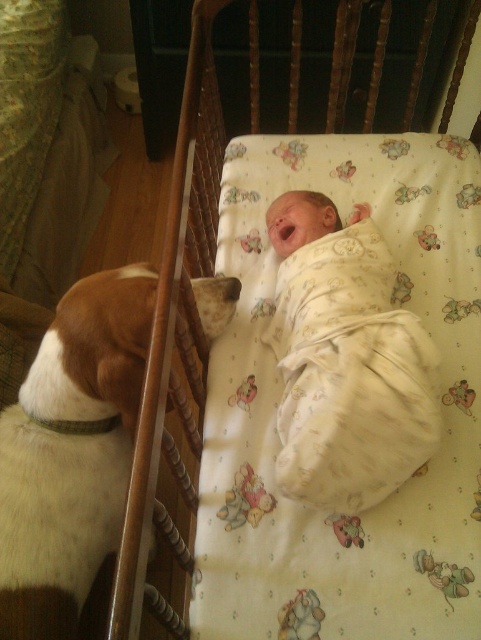
Can you confirm if brown and white fur at left is taller than white swaddled baby at center?

Incorrect, brown and white fur at left's height is not larger of white swaddled baby at center's.

Is brown and white fur at left shorter than white swaddled baby at center?

Yes, brown and white fur at left is shorter than white swaddled baby at center.

Is point (29, 490) positioned in front of point (278, 220)?

Yes.

Locate an element on the screen. brown and white fur at left is located at coordinates (71, 451).

Which is in front, point (333, 531) or point (355, 504)?

Point (355, 504)

Can you confirm if white soft fabric at center is thinner than white swaddled baby at center?

In fact, white soft fabric at center might be wider than white swaddled baby at center.

You are a GUI agent. You are given a task and a screenshot of the screen. Output one action in this format:
    pyautogui.click(x=<x>, y=<y>)
    Task: Click on the white soft fabric at center
    The image size is (481, 640).
    Given the screenshot: What is the action you would take?
    pyautogui.click(x=278, y=392)

The height and width of the screenshot is (640, 481). What are the coordinates of `white soft fabric at center` in the screenshot? It's located at (278, 392).

Can you confirm if white soft fabric at center is positioned to the left of brown and white fur at left?

No, white soft fabric at center is not to the left of brown and white fur at left.

This screenshot has height=640, width=481. What do you see at coordinates (278, 392) in the screenshot? I see `white soft fabric at center` at bounding box center [278, 392].

Who is more forward, (213, 419) or (22, 577)?

Point (22, 577) is in front.

This screenshot has width=481, height=640. Identify the location of white soft fabric at center. (278, 392).